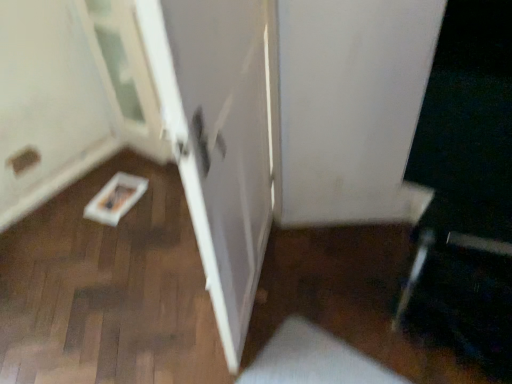
At what (x,y) coordinates should I click in order to perform the action: click on free space to the left of white glossy door at center. Please return your answer as a coordinate pair (x, y). This screenshot has height=384, width=512. Looking at the image, I should click on (143, 289).